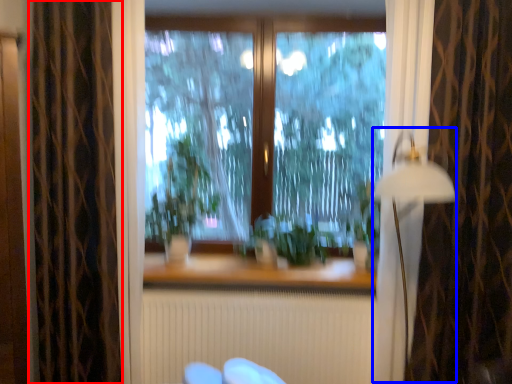
Question: Which object is closer to the camera taking this photo, curtain (highlighted by a red box) or lamp (highlighted by a blue box)?

Choices:
 (A) curtain
 (B) lamp

Answer: (B)